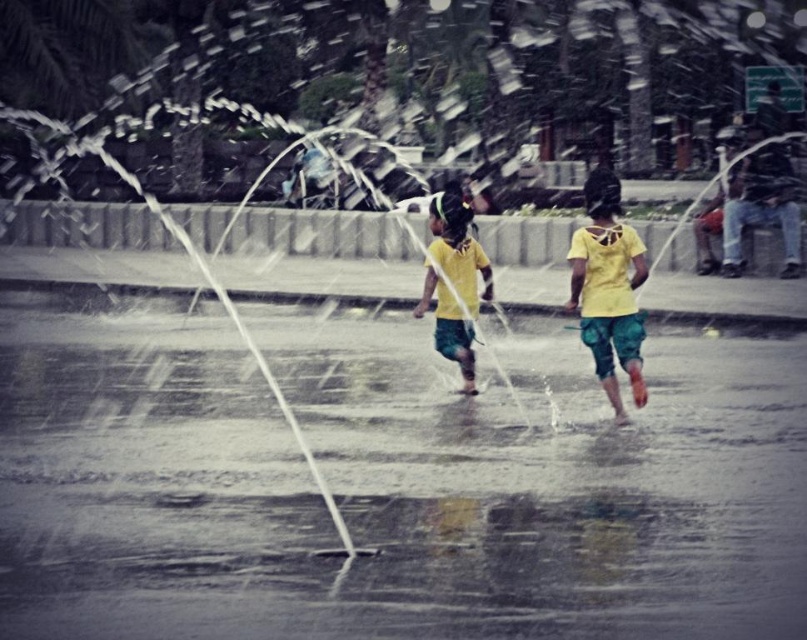
Is clear water at center above yellow matte shirt at center?

Actually, clear water at center is below yellow matte shirt at center.

In the scene shown: Does clear water at center appear on the left side of yellow matte shirt at center?

Incorrect, clear water at center is not on the left side of yellow matte shirt at center.

Image resolution: width=807 pixels, height=640 pixels. Describe the element at coordinates (391, 484) in the screenshot. I see `clear water at center` at that location.

The height and width of the screenshot is (640, 807). What are the coordinates of `clear water at center` in the screenshot? It's located at (391, 484).

Does clear water at center have a greater width compared to yellow fabric shorts at center?

Correct, the width of clear water at center exceeds that of yellow fabric shorts at center.

This screenshot has width=807, height=640. What do you see at coordinates (391, 484) in the screenshot? I see `clear water at center` at bounding box center [391, 484].

The image size is (807, 640). I want to click on clear water at center, so click(391, 484).

Between yellow fabric shorts at center and yellow matte shirt at center, which one has less height?

With less height is yellow matte shirt at center.

I want to click on yellow fabric shorts at center, so click(608, 289).

Between point (578, 294) and point (433, 284), which one is positioned in front?

Positioned in front is point (578, 294).

Where is `yellow fabric shorts at center`? This screenshot has width=807, height=640. yellow fabric shorts at center is located at coordinates (608, 289).